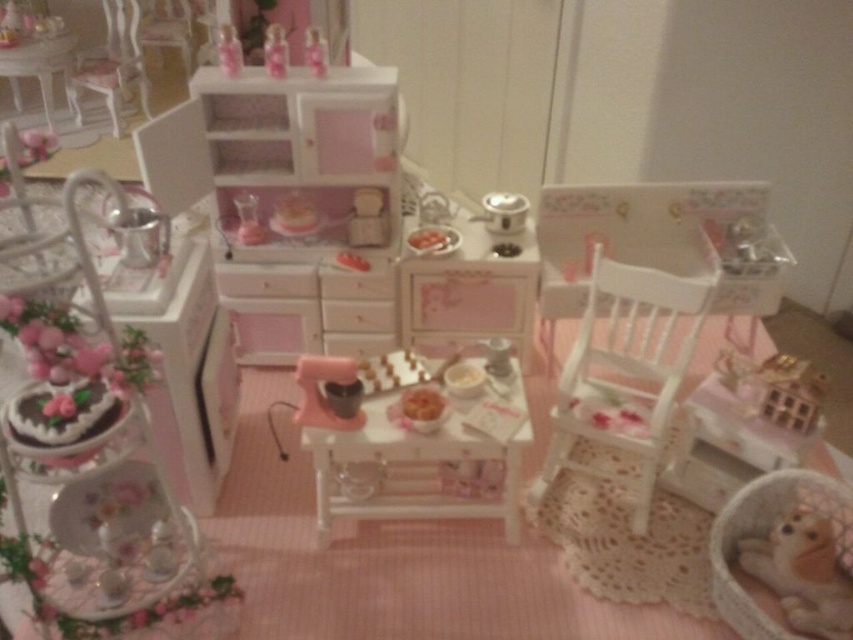
Who is higher up, white wooden chair at center or matte pink cabinet at upper center?

matte pink cabinet at upper center is above.

Does white wooden chair at center appear over matte pink cabinet at upper center?

Actually, white wooden chair at center is below matte pink cabinet at upper center.

Where is `white wooden chair at center`? The image size is (853, 640). white wooden chair at center is located at coordinates (624, 376).

Identify the location of white wooden chair at center. (624, 376).

Is point (273, 28) positioned before point (238, 74)?

Yes, point (273, 28) is closer to viewer.

Which of these two, matte pink cabinet at upper center or matte pink glass at upper center, stands taller?

With more height is matte pink cabinet at upper center.

This screenshot has height=640, width=853. What do you see at coordinates (276, 51) in the screenshot? I see `matte pink cabinet at upper center` at bounding box center [276, 51].

What are the coordinates of `matte pink cabinet at upper center` in the screenshot? It's located at (276, 51).

Does white glossy table at center have a greater height compared to matte plastic cabinet at upper center?

Correct, white glossy table at center is much taller as matte plastic cabinet at upper center.

Does point (480, 458) come behind point (306, 45)?

That is False.

The height and width of the screenshot is (640, 853). What do you see at coordinates (422, 464) in the screenshot? I see `white glossy table at center` at bounding box center [422, 464].

You are a GUI agent. You are given a task and a screenshot of the screen. Output one action in this format:
    pyautogui.click(x=<x>, y=<y>)
    Task: Click on the white glossy table at center
    This screenshot has width=853, height=640.
    Given the screenshot: What is the action you would take?
    pyautogui.click(x=422, y=464)